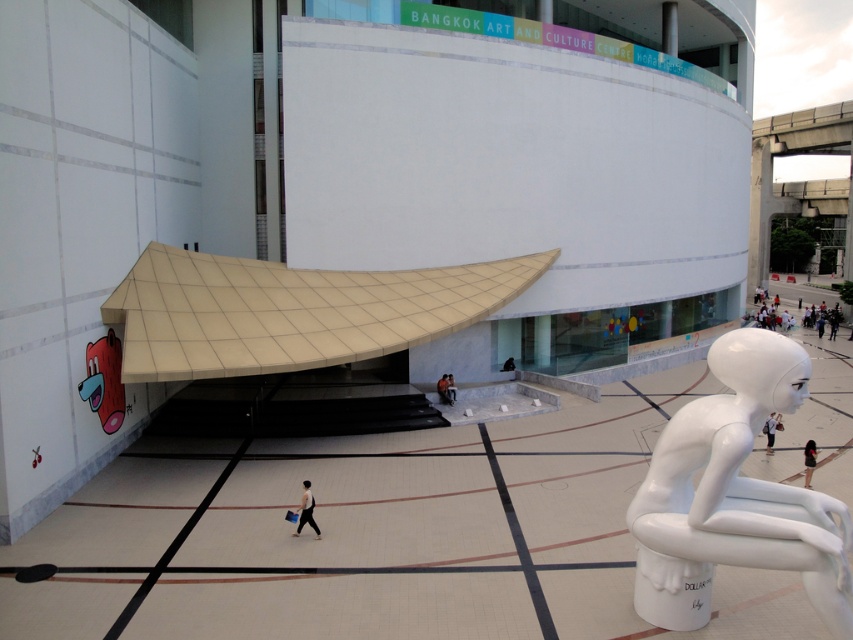
Question: Estimate the real-world distances between objects in this image. Which object is closer to the white glossy statue at lower right?

Choices:
 (A) light gray fabric bag at lower center
 (B) white glossy sculpture at right

Answer: (B)

Question: Can you confirm if beige tile canopy at center is thinner than white glossy statue at lower right?

Choices:
 (A) no
 (B) yes

Answer: (A)

Question: Does beige tile canopy at center come in front of white glossy sculpture at right?

Choices:
 (A) no
 (B) yes

Answer: (A)

Question: Can you confirm if beige tile canopy at center is positioned to the left of black fabric person at lower right?

Choices:
 (A) yes
 (B) no

Answer: (A)

Question: Among these objects, which one is nearest to the camera?

Choices:
 (A) light brown leather jacket at center
 (B) white glossy sculpture at right

Answer: (B)

Question: Which is farther from the light brown leather jacket at center?

Choices:
 (A) light gray fabric bag at lower center
 (B) beige tile canopy at center
 (C) white glossy sculpture at right
 (D) black fabric person at lower right

Answer: (C)